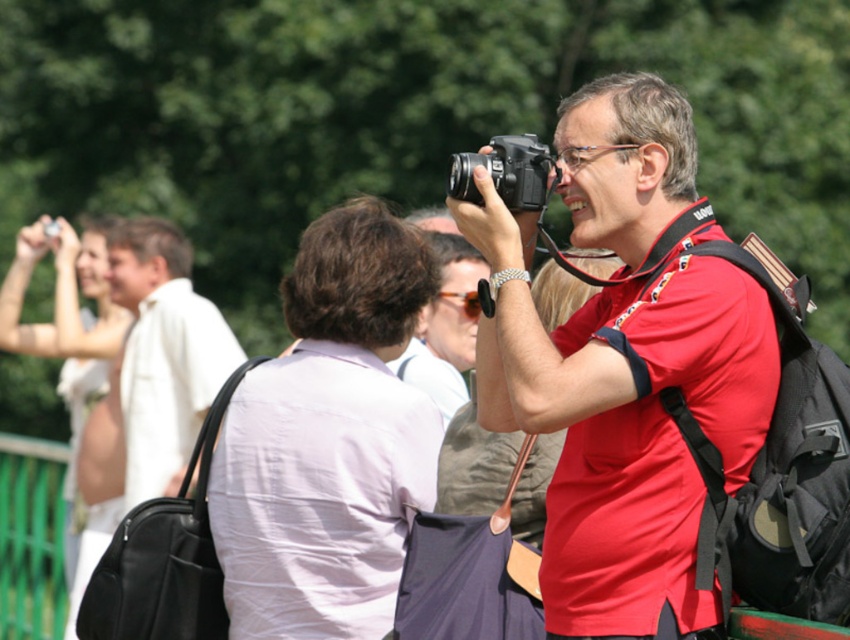
You are organizing a photography workshop and need to arrange equipment. You have a matte black camera at center and a white fabric purse at left. Which item takes up more space?

The white fabric purse at left takes up more space than the matte black camera at center.